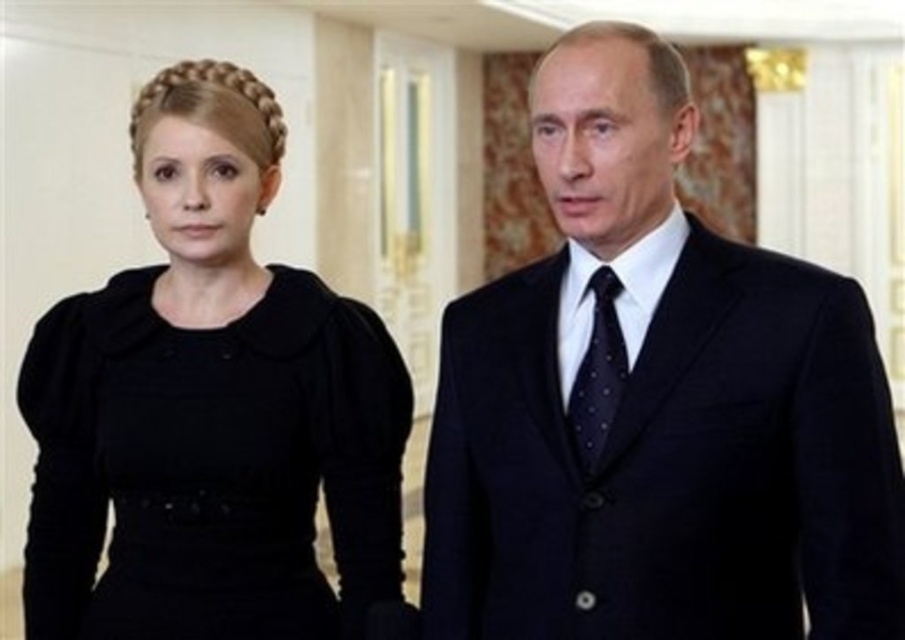
Between point (384, 496) and point (611, 276), which one is positioned in front?

Positioned in front is point (611, 276).

The width and height of the screenshot is (905, 640). What do you see at coordinates (212, 410) in the screenshot?
I see `black velvet dress at left` at bounding box center [212, 410].

At what (x,y) coordinates should I click in order to perform the action: click on black velvet dress at left. Please return your answer as a coordinate pair (x, y). This screenshot has height=640, width=905. Looking at the image, I should click on (212, 410).

Is matte black suit at center smaller than dark blue dotted tie at center?

No.

The height and width of the screenshot is (640, 905). Find the location of `matte black suit at center`. matte black suit at center is located at coordinates (656, 404).

Is point (592, 38) positioned after point (575, 381)?

No, it is in front of (575, 381).

Find the location of a particular element. The height and width of the screenshot is (640, 905). matte black suit at center is located at coordinates (656, 404).

Between matte black suit at center and black velvet dress at left, which one is positioned higher?

Positioned higher is matte black suit at center.

What do you see at coordinates (656, 404) in the screenshot? This screenshot has width=905, height=640. I see `matte black suit at center` at bounding box center [656, 404].

Who is more forward, (x=588, y=547) or (x=401, y=396)?

Point (x=588, y=547) is in front.

Locate an element on the screen. This screenshot has height=640, width=905. matte black suit at center is located at coordinates (656, 404).